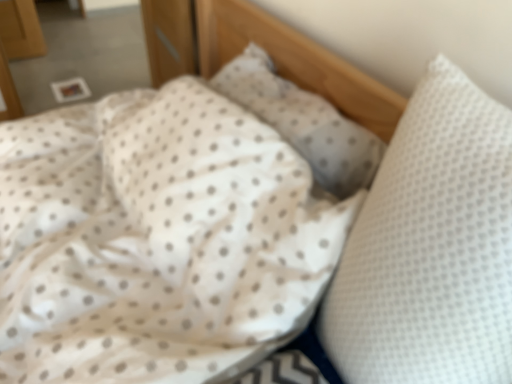
Question: Considering their positions, is white dotted pillow at center, the second pillow positioned from the front, located in front of or behind white dotted pillow at right, arranged as the first pillow when viewed from the front?

Choices:
 (A) front
 (B) behind

Answer: (B)

Question: From a real-world perspective, relative to white dotted pillow at right, arranged as the first pillow when viewed from the front, is white dotted pillow at center, the second pillow positioned from the front, vertically above or below?

Choices:
 (A) above
 (B) below

Answer: (B)

Question: Does point (308, 130) appear closer or farther from the camera than point (423, 274)?

Choices:
 (A) closer
 (B) farther

Answer: (B)

Question: From the image's perspective, is white dotted pillow at right, arranged as the first pillow when viewed from the front, positioned above or below white dotted pillow at center, the second pillow positioned from the front?

Choices:
 (A) above
 (B) below

Answer: (B)

Question: Considering the positions of white dotted pillow at right, positioned as the 2th pillow in back-to-front order, and white dotted pillow at center, positioned as the first pillow in back-to-front order, in the image, is white dotted pillow at right, positioned as the 2th pillow in back-to-front order, taller or shorter than white dotted pillow at center, positioned as the first pillow in back-to-front order,?

Choices:
 (A) short
 (B) tall

Answer: (B)

Question: Is white dotted pillow at right, arranged as the first pillow when viewed from the front, in front of or behind white dotted pillow at center, the second pillow positioned from the front, in the image?

Choices:
 (A) behind
 (B) front

Answer: (B)

Question: Based on their positions, is white dotted pillow at right, positioned as the 2th pillow in back-to-front order, located to the left or right of white dotted pillow at center, positioned as the first pillow in back-to-front order?

Choices:
 (A) right
 (B) left

Answer: (A)